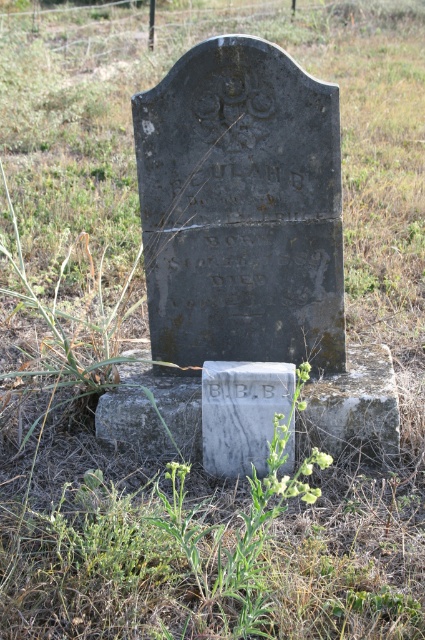
You are standing in a cemetery and see the green leafy weed at center and the white marble gravestone at center. Which object is closer to you?

The green leafy weed at center is closer to you because it is in front of the white marble gravestone at center.

You are standing in a cemetery and see the green leafy weed at center and the white marble gravestone at center. Which object is positioned to the left of the other?

The green leafy weed at center is to the right of the white marble gravestone at center, so the white marble gravestone at center is positioned to the left of the green leafy weed at center.

You are a gardener who wants to remove weeds from the cemetery. There is a green leafy weed at center and a white marble gravestone at center. Which object is wider?

The green leafy weed at center is wider than the white marble gravestone at center according to the description.